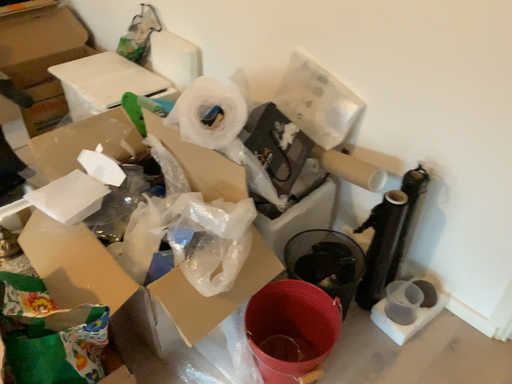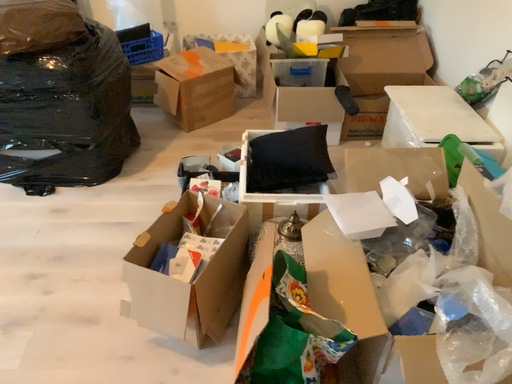
Question: Which way did the camera rotate in the video?

Choices:
 (A) rotated left
 (B) rotated right

Answer: (A)